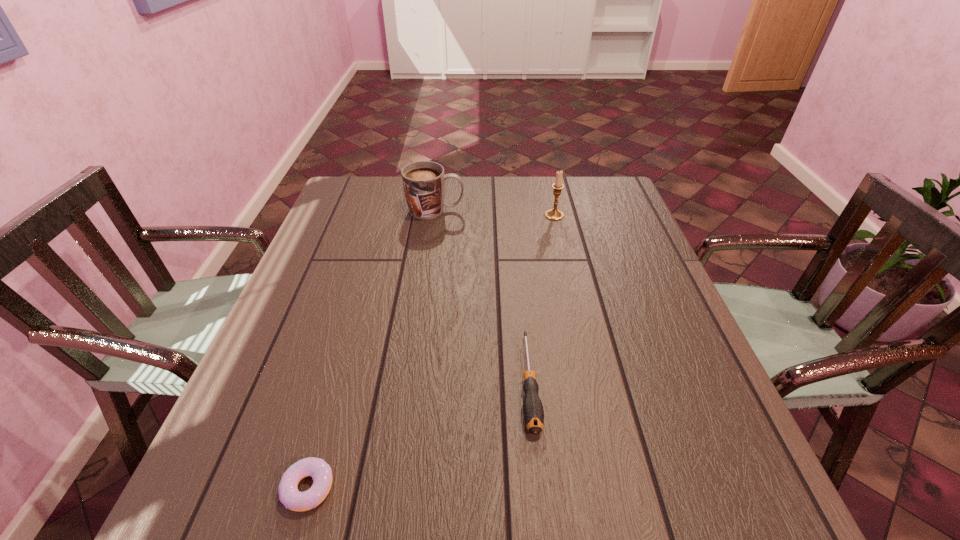
This screenshot has width=960, height=540. I want to click on the rightmost object, so click(x=553, y=214).

Locate an element on the screen. This screenshot has width=960, height=540. mug is located at coordinates (424, 181).

Where is `the second nearest object`? The height and width of the screenshot is (540, 960). the second nearest object is located at coordinates (533, 412).

At what (x,y) coordinates should I click in order to perform the action: click on the third object from left to right. Please return your answer as a coordinate pair (x, y). Looking at the image, I should click on (533, 412).

At what (x,y) coordinates should I click in order to perform the action: click on the leftmost object. Please return your answer as a coordinate pair (x, y). This screenshot has height=540, width=960. Looking at the image, I should click on (321, 473).

This screenshot has width=960, height=540. Identify the location of the shortest object. (321, 473).

Identify the location of vacant space located on the front of the rightmost object. (559, 234).

At what (x,y) coordinates should I click in order to perform the action: click on vacant space situated on the side of the third object from right to left with the handle. Please return your answer as a coordinate pair (x, y). This screenshot has width=960, height=540. Looking at the image, I should click on (575, 210).

At what (x,y) coordinates should I click in order to perform the action: click on vacant position located 0.280m on the right of the third farthest object. Please return your answer as a coordinate pair (x, y). This screenshot has width=960, height=540. Looking at the image, I should click on (680, 382).

Image resolution: width=960 pixels, height=540 pixels. What are the coordinates of `free location located 0.400m on the right of the nearest object` in the screenshot? It's located at (577, 488).